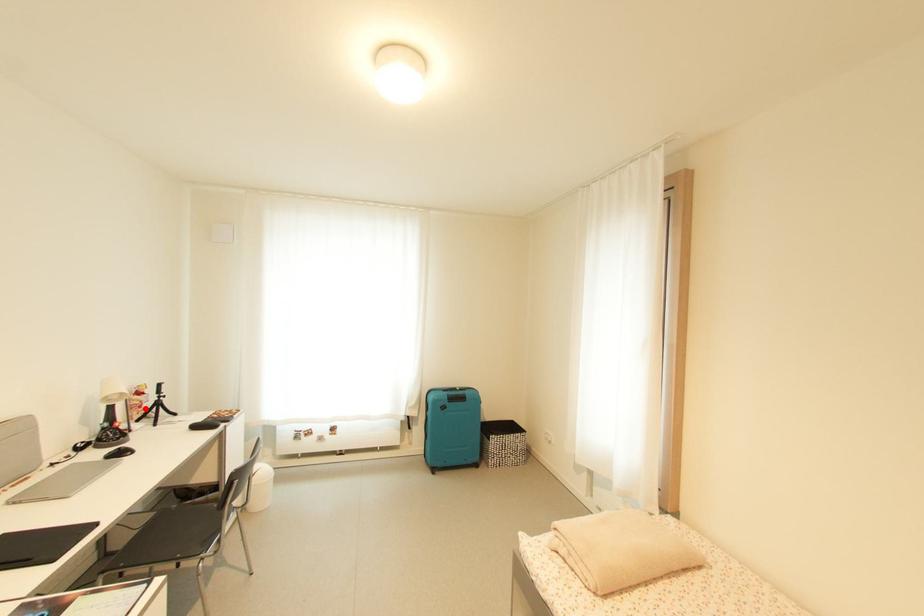
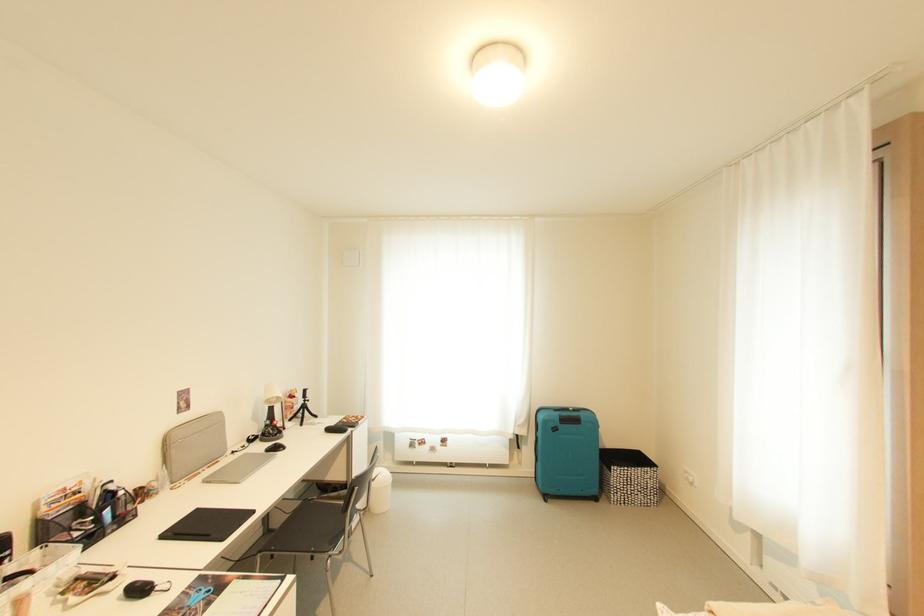
In the second image, find the point that corresponds to the highlighted location in the first image.

(297, 410)